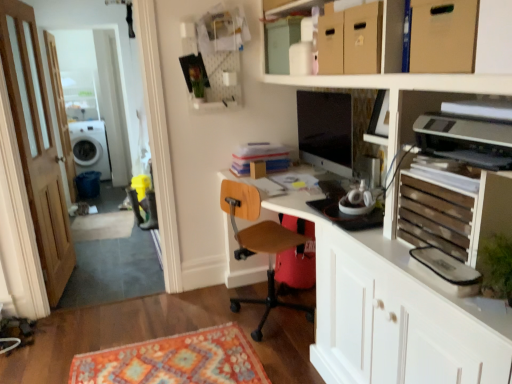
You are a GUI agent. You are given a task and a screenshot of the screen. Output one action in this format:
    pyautogui.click(x=<x>, y=<y>)
    Task: Click on the cardboard box at upper right
    The image size is (512, 384).
    Given the screenshot: What is the action you would take?
    pyautogui.click(x=443, y=36)

At what (x,y) coordinates should I click in order to perform the action: click on wooden slats at right. Please return your answer as a coordinate pair (x, y). The image size is (512, 384). Looking at the image, I should click on (434, 217).

The height and width of the screenshot is (384, 512). In order to click on matte black monitor at center in this screenshot , I will do `click(325, 130)`.

Image resolution: width=512 pixels, height=384 pixels. What do you see at coordinates (396, 315) in the screenshot?
I see `white glossy entertainment center at upper center` at bounding box center [396, 315].

The image size is (512, 384). I want to click on cardboard box at upper right, so [x=443, y=36].

Could you tell me if wooden door at left is facing cardboard box at upper right?

No, wooden door at left is not aimed at cardboard box at upper right.

Is wooden door at left positioned beyond the bounds of cardboard box at upper right?

Yes, wooden door at left is not within cardboard box at upper right.

Does point (0, 15) appear closer or farther from the camera than point (442, 62)?

Point (0, 15) is farther from the camera than point (442, 62).

From a real-world perspective, does wooden door at left stand above cardboard box at upper right?

No, from a real-world perspective, wooden door at left is not on top of cardboard box at upper right.

Is brown wooden screen door at left directly adjacent to wooden slats at right?

No, brown wooden screen door at left is not next to wooden slats at right.

Where is `drawer below the brown wooden screen door at left (from the image's perspective)`? The width and height of the screenshot is (512, 384). drawer below the brown wooden screen door at left (from the image's perspective) is located at coordinates (434, 217).

Choose the correct answer: Is brown wooden screen door at left inside wooden slats at right or outside it?

brown wooden screen door at left is not inside wooden slats at right, it's outside.

From a real-world perspective, which object stands above the other?

In real-world perspective, brown wooden screen door at left is above.

The width and height of the screenshot is (512, 384). What are the coordinates of `cardboard box lying above the white glossy entertainment center at upper center (from the image's perspective)` in the screenshot? It's located at (443, 36).

Can you confirm if cardboard box at upper right is shorter than white glossy entertainment center at upper center?

Yes, cardboard box at upper right is shorter than white glossy entertainment center at upper center.

From a real-world perspective, which object rests below the other?

In real-world perspective, white glossy entertainment center at upper center is lower.

Does cardboard box at upper right lie behind white glossy entertainment center at upper center?

Yes.

Is wooden slats at right inside the boundaries of white glossy entertainment center at upper center, or outside?

wooden slats at right is enclosed within white glossy entertainment center at upper center.

Identify the location of drawer above the white glossy entertainment center at upper center (from a real-world perspective). The width and height of the screenshot is (512, 384). (434, 217).

Which of these two, wooden slats at right or white glossy entertainment center at upper center, is wider?

white glossy entertainment center at upper center is wider.

How many degrees apart are the facing directions of wooden slats at right and white glossy entertainment center at upper center?

They differ by 0.53 degrees in their facing directions.

Considering the positions of objects wooden door at left and wooden at center in the image provided, who is more to the left, wooden door at left or wooden at center?

wooden door at left is more to the left.

Looking at their sizes, would you say wooden door at left is wider or thinner than wooden at center?

Considering their sizes, wooden door at left looks slimmer than wooden at center.

From the image's perspective, which object appears higher, wooden door at left or wooden at center?

wooden door at left appears higher in the image.

Consider the image. Could wooden at center be considered to be inside wooden door at left?

No, wooden at center is not inside wooden door at left.

Which is behind, point (433, 374) or point (421, 48)?

Positioned behind is point (421, 48).

Is white glossy entertainment center at upper center bigger than cardboard box at upper right?

Correct, white glossy entertainment center at upper center is larger in size than cardboard box at upper right.

Is white glossy entertainment center at upper center located outside cardboard box at upper right?

Absolutely, white glossy entertainment center at upper center is external to cardboard box at upper right.

Is white glossy entertainment center at upper center far away from cardboard box at upper right?

Yes, white glossy entertainment center at upper center and cardboard box at upper right are quite far apart.

Where is `chair on the right of white glossy washing machine at left`? The height and width of the screenshot is (384, 512). chair on the right of white glossy washing machine at left is located at coordinates (258, 244).

Which is in front, point (275, 243) or point (75, 130)?

The point (275, 243) is more forward.

Looking at this image, considering the sizes of wooden at center and white glossy washing machine at left in the image, is wooden at center taller or shorter than white glossy washing machine at left?

In the image, wooden at center appears to be taller than white glossy washing machine at left.

In the scene shown: In terms of width, does wooden at center look wider or thinner when compared to white glossy washing machine at left?

In the image, wooden at center appears to be more narrow than white glossy washing machine at left.

What are the coordinates of `door below the cardboard box at upper right (from a real-world perspective)` in the screenshot? It's located at (36, 144).

Identify the location of drawer on the right of brown wooden screen door at left. (434, 217).

Based on the photo, when comparing their distances from wooden slats at right, does brown wooden screen door at left or white glossy washing machine at left seem closer?

Based on the image, brown wooden screen door at left appears to be nearer to wooden slats at right.

When comparing their distances from white glossy entertainment center at upper center, does wooden door at left or wooden slats at right seem further?

wooden slats at right is further to white glossy entertainment center at upper center.

Estimate the real-world distances between objects in this image. Which object is further from white glossy entertainment center at upper center, wooden slats at right or wooden door at left?

Based on the image, wooden slats at right appears to be further to white glossy entertainment center at upper center.

Estimate the real-world distances between objects in this image. Which object is further from brown wooden screen door at left, wooden slats at right or matte black monitor at center?

wooden slats at right is positioned further to the anchor brown wooden screen door at left.

From the image, which object appears to be nearer to wooden at center, cardboard box at upper right or white glossy washing machine at left?

The object closer to wooden at center is cardboard box at upper right.

Looking at the image, which one is located closer to brown wooden screen door at left, matte black monitor at center or wooden door at left?

wooden door at left is positioned closer to the anchor brown wooden screen door at left.

Consider the image. From the image, which object appears to be nearer to wooden door at left, wooden slats at right or white glossy washing machine at left?

The object closer to wooden door at left is wooden slats at right.

From the image, which object appears to be farther from wooden slats at right, brown wooden screen door at left or wooden at center?

brown wooden screen door at left is further to wooden slats at right.

Identify the location of computer monitor between wooden slats at right and white glossy washing machine at left along the z-axis. Image resolution: width=512 pixels, height=384 pixels. pyautogui.click(x=325, y=130).

At what (x,y) coordinates should I click in order to perform the action: click on chair between white glossy entertainment center at upper center and white glossy washing machine at left from front to back. Please return your answer as a coordinate pair (x, y). Looking at the image, I should click on (258, 244).

This screenshot has height=384, width=512. I want to click on cardboard box positioned between white glossy entertainment center at upper center and white glossy washing machine at left from near to far, so click(443, 36).

This screenshot has height=384, width=512. I want to click on door between wooden slats at right and brown wooden screen door at left along the z-axis, so click(36, 144).